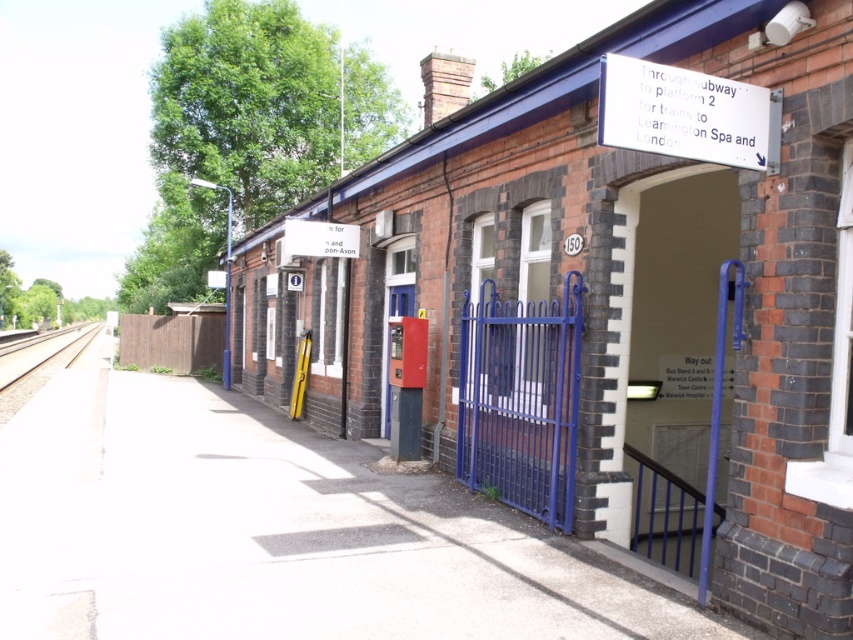
Question: Can you confirm if white plastic sign at upper right is positioned above smooth concrete train track at left?

Choices:
 (A) no
 (B) yes

Answer: (B)

Question: Can you confirm if smooth concrete train track at left is positioned below white paper sign at center?

Choices:
 (A) no
 (B) yes

Answer: (B)

Question: Which point appears farthest from the camera in this image?

Choices:
 (A) (688, 72)
 (B) (310, 243)

Answer: (B)

Question: Is white plastic sign at upper right positioned behind white paper sign at center?

Choices:
 (A) yes
 (B) no

Answer: (B)

Question: Estimate the real-world distances between objects in this image. Which object is farther from the smooth concrete train track at left?

Choices:
 (A) white paper sign at center
 (B) white plastic sign at upper right

Answer: (B)

Question: Which object is the farthest from the white plastic sign at upper right?

Choices:
 (A) white paper sign at center
 (B) smooth concrete train track at left

Answer: (B)